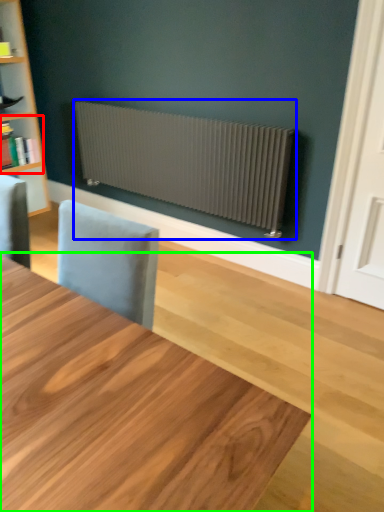
Question: Which is nearer to the shelf (highlighted by a red box)? radiator (highlighted by a blue box) or table (highlighted by a green box).

Choices:
 (A) radiator
 (B) table

Answer: (A)